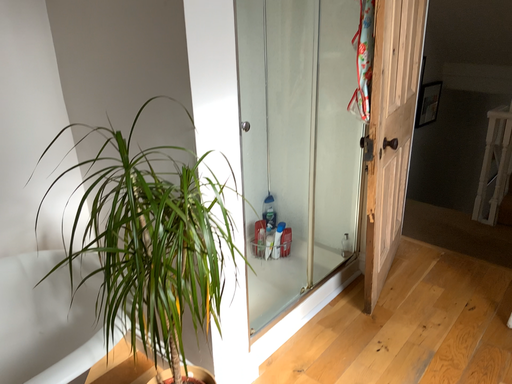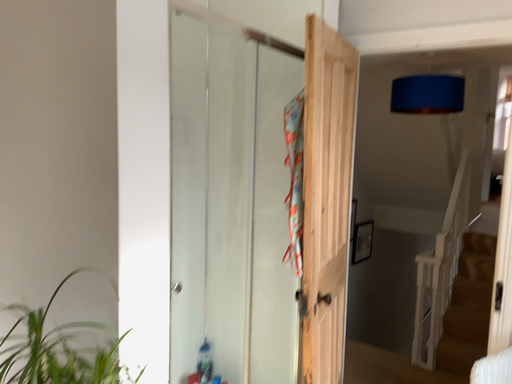
Question: Which way did the camera rotate in the video?

Choices:
 (A) rotated right
 (B) rotated left

Answer: (A)